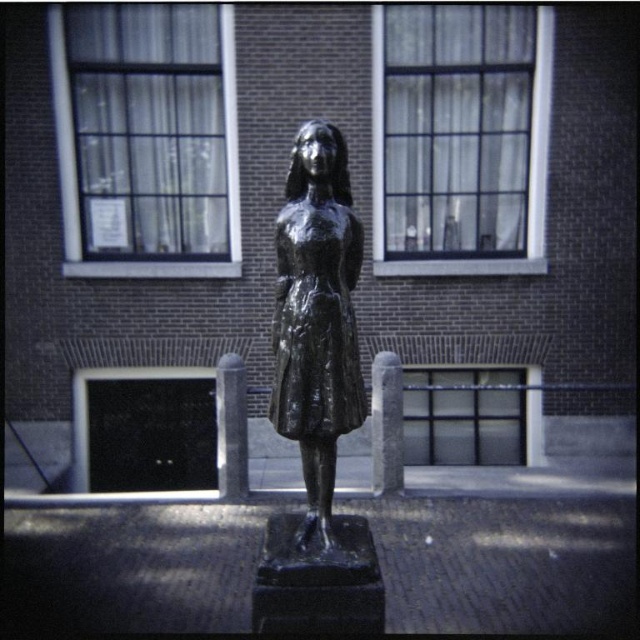
Question: Is the position of bronze statue at center more distant than that of shiny black dress at center?

Choices:
 (A) no
 (B) yes

Answer: (A)

Question: Which point is closer to the camera taking this photo?

Choices:
 (A) (321, 221)
 (B) (292, 339)

Answer: (B)

Question: Is bronze statue at center positioned before shiny black dress at center?

Choices:
 (A) no
 (B) yes

Answer: (B)

Question: Can you confirm if bronze statue at center is bigger than shiny black dress at center?

Choices:
 (A) no
 (B) yes

Answer: (B)

Question: Which point is closer to the camera?

Choices:
 (A) (342, 422)
 (B) (308, 417)

Answer: (A)